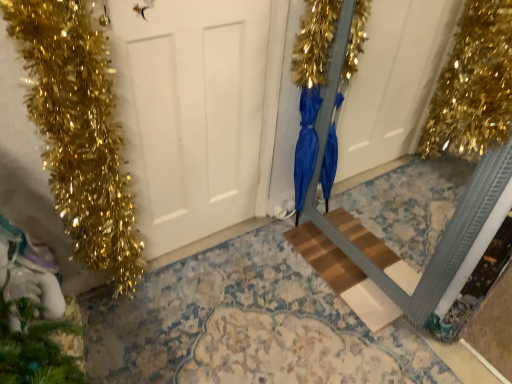
Question: Considering the positions of green matte pine cone at lower left and wooden step at center in the image, is green matte pine cone at lower left bigger or smaller than wooden step at center?

Choices:
 (A) small
 (B) big

Answer: (B)

Question: Is green matte pine cone at lower left inside or outside of wooden step at center?

Choices:
 (A) inside
 (B) outside

Answer: (B)

Question: Which is nearer to the white matte door at center?

Choices:
 (A) green matte pine cone at lower left
 (B) wooden step at center
 (C) blue satin dress at center

Answer: (C)

Question: Which is nearer to the wooden step at center?

Choices:
 (A) blue satin dress at center
 (B) white matte door at center
 (C) green matte pine cone at lower left

Answer: (A)